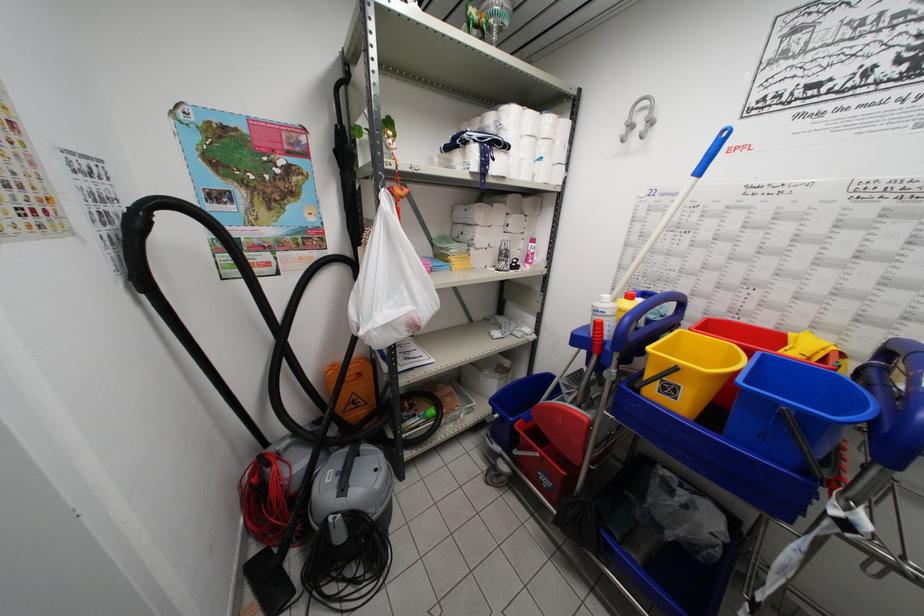
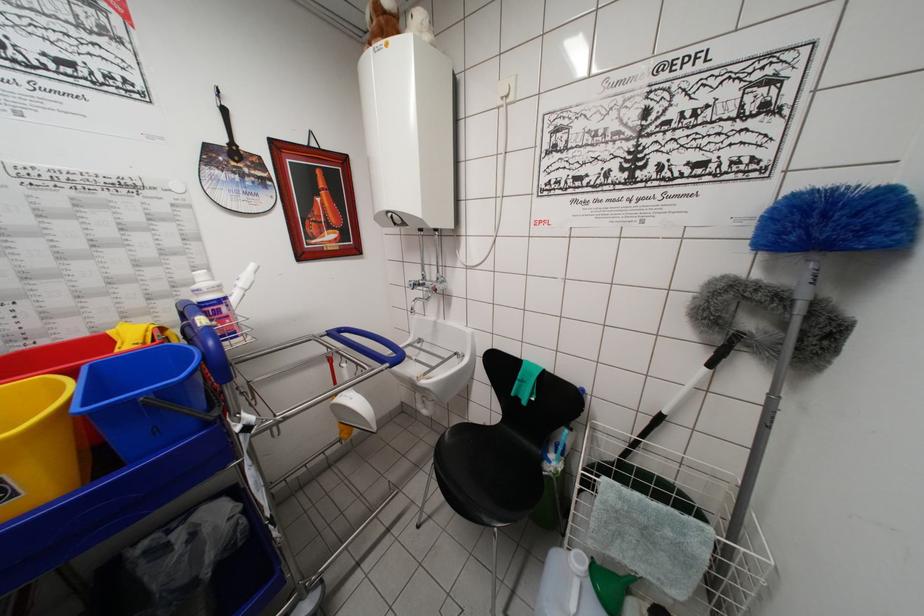
The point at [845,360] is marked in the first image. Where is the corresponding point in the second image?

(165, 333)